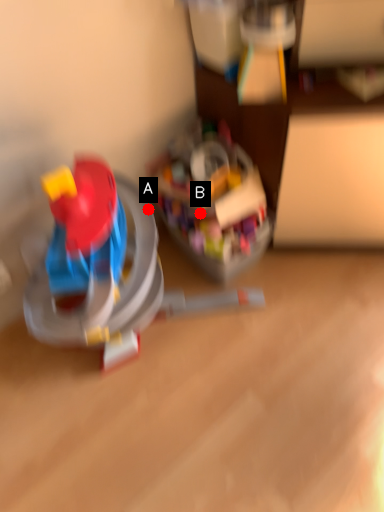
Question: Two points are circled on the image, labeled by A and B beside each circle. Which point is closer to the camera?

Choices:
 (A) A is closer
 (B) B is closer

Answer: (A)